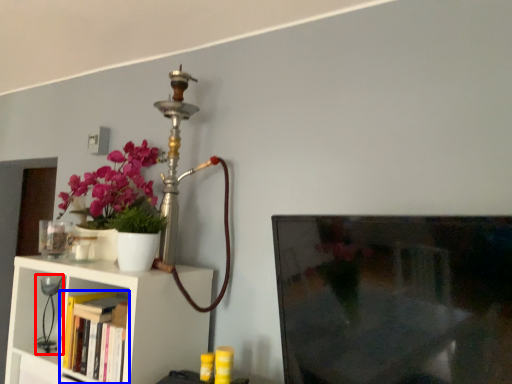
Question: Which object appears closest to the camera in this image, table lamp (highlighted by a red box) or book (highlighted by a blue box)?

Choices:
 (A) table lamp
 (B) book

Answer: (B)